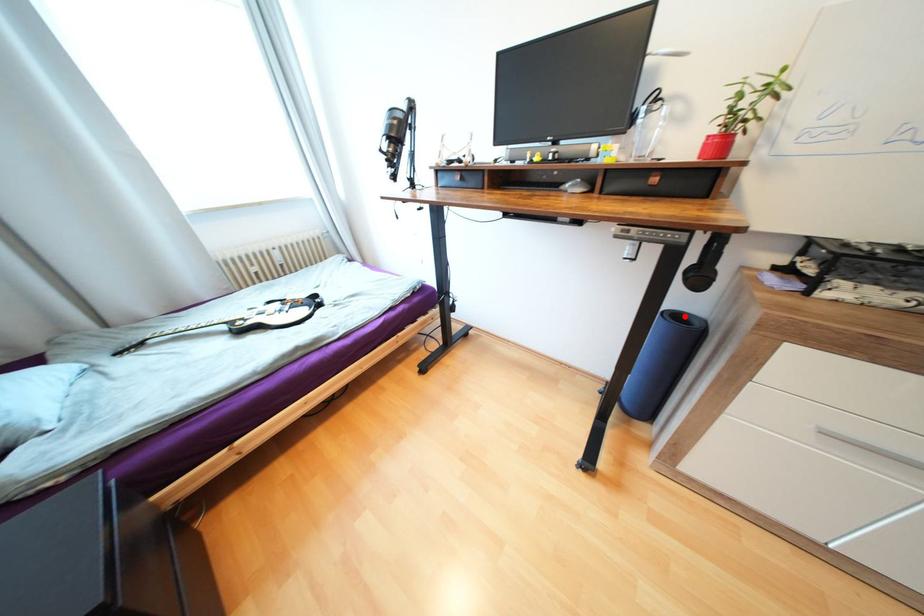
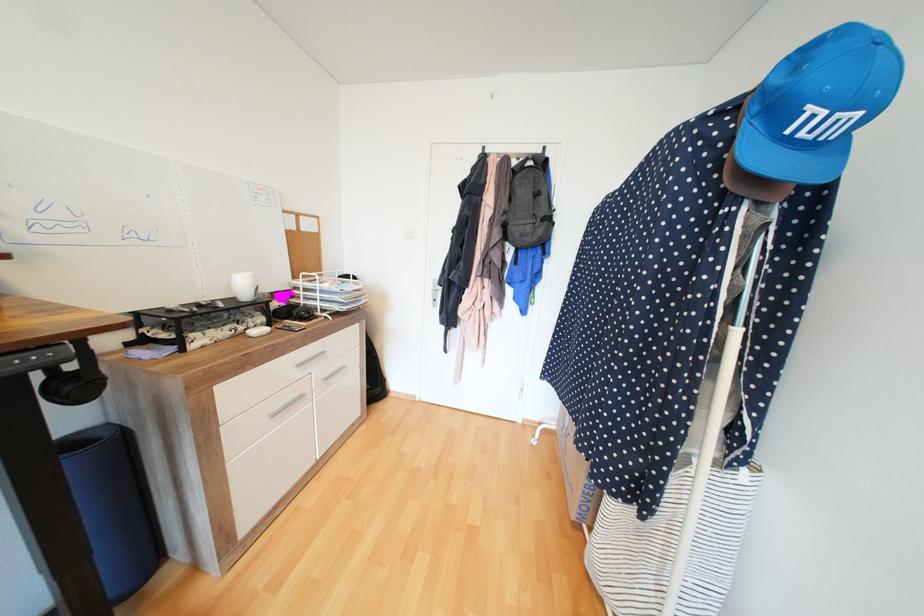
Question: I am providing you with two images of the same scene from different viewpoints. Image1 has a red point marked. In image2, the corresponding 3D location appears at what relative position? Reply with the corresponding letter.

Choices:
 (A) Closer
 (B) Farther

Answer: (B)